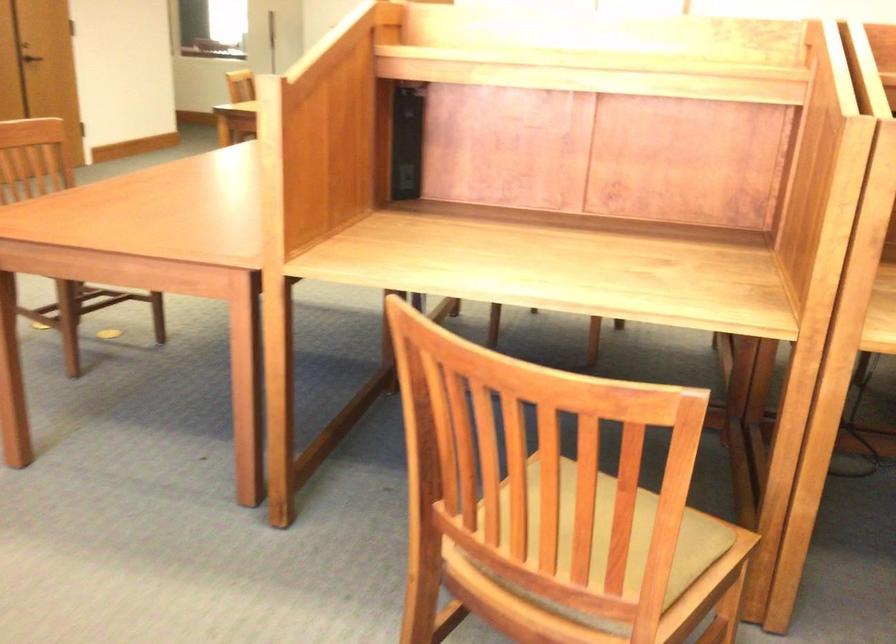
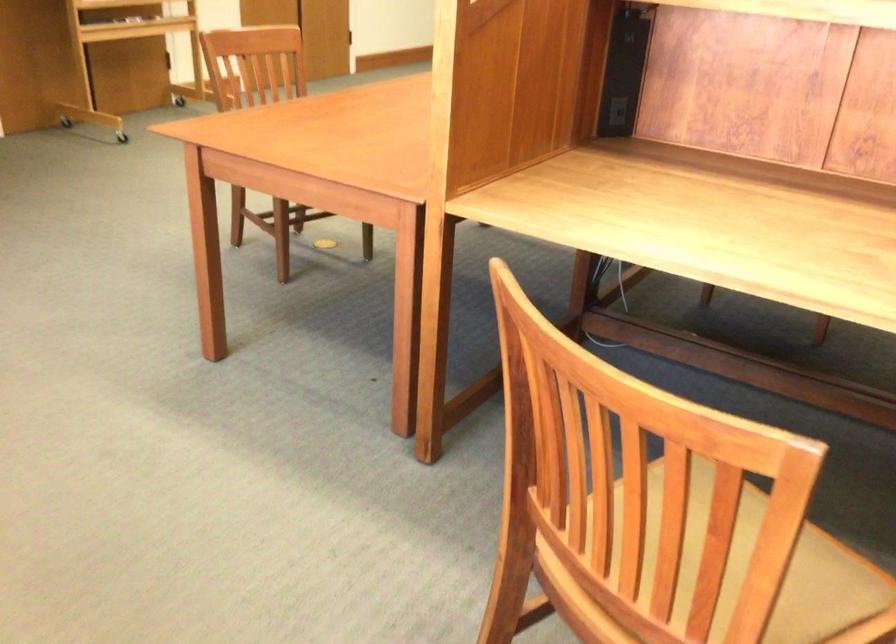
In the second image, find the point that corresponds to the point at 408,176 in the first image.

(616, 111)